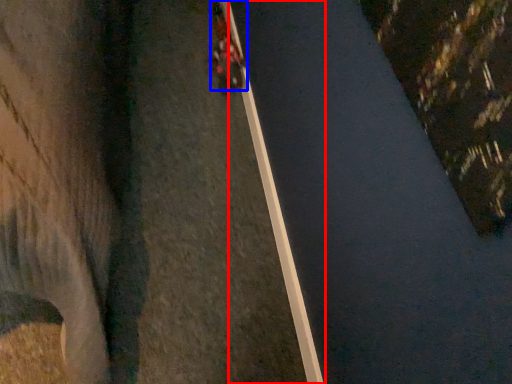
Question: Which of the following is the closest to the observer, curb (highlighted by a red box) or vehicle (highlighted by a blue box)?

Choices:
 (A) curb
 (B) vehicle

Answer: (A)